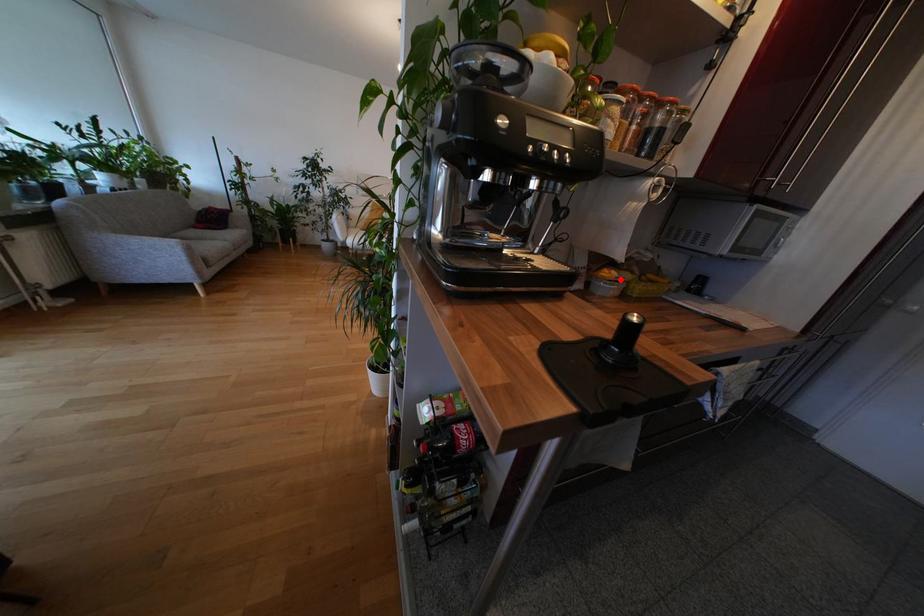
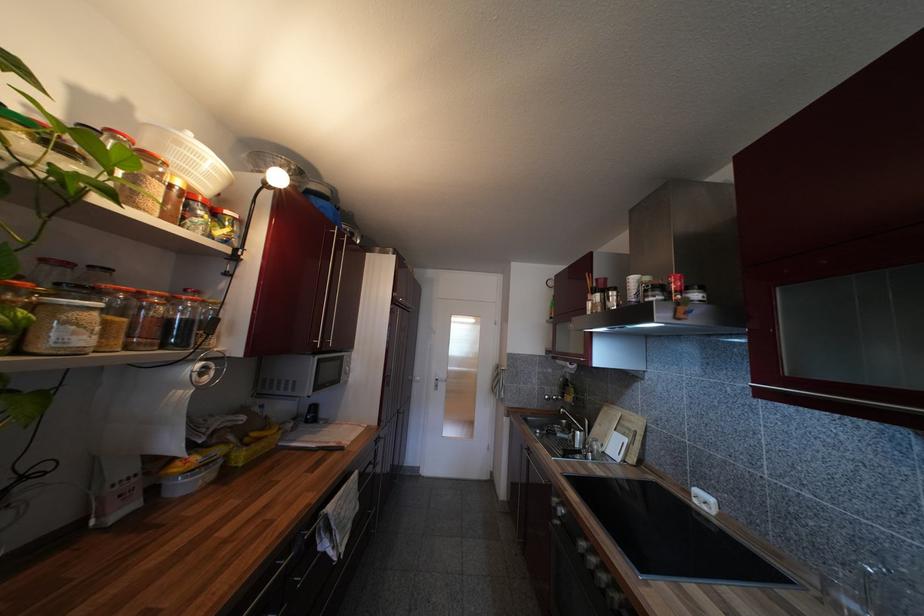
Where in the second image is the point corresponding to the highlighted location from the first image?

(204, 464)